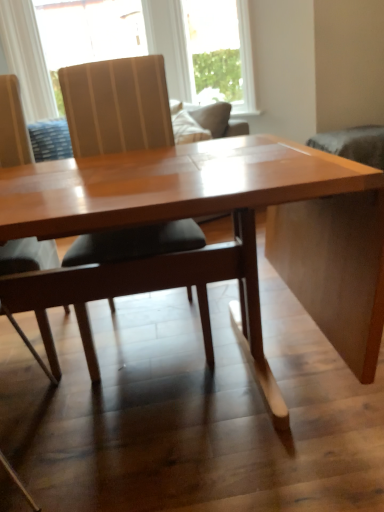
In order to face clear glass window at upper center, the 2th window from the left, should I rotate leftwards or rightwards?

It's best to rotate right around 2.366 degrees.

Describe the element at coordinates (165, 217) in the screenshot. I see `wooden table at center` at that location.

Identify the location of matte wood chair at left, the first chair in the left-to-right sequence. Image resolution: width=384 pixels, height=512 pixels. (13, 125).

Is point (236, 185) positioned after point (236, 113)?

No, (236, 185) is in front of (236, 113).

Considering the sizes of objects wooden table at center and clear glass window at upper center, the 2th window from the left, in the image provided, who is shorter, wooden table at center or clear glass window at upper center, the 2th window from the left,?

wooden table at center is shorter.

From the image's perspective, is wooden table at center under clear glass window at upper center, which is the first window from right to left?

Correct, wooden table at center appears lower than clear glass window at upper center, which is the first window from right to left, in the image.

Is wooden table at center positioned with its back to clear glass window at upper center, which is the first window from right to left?

No, clear glass window at upper center, which is the first window from right to left, is not at the back of wooden table at center.

Considering the sizes of objects wooden table at center and matte wood chair at center, positioned as the second chair in left-to-right order, in the image provided, who is thinner, wooden table at center or matte wood chair at center, positioned as the second chair in left-to-right order,?

matte wood chair at center, positioned as the second chair in left-to-right order, is thinner.

Considering the points (166, 265) and (85, 319), which point is behind, point (166, 265) or point (85, 319)?

The point (85, 319) is farther.

Consider the image. Could you tell me if wooden table at center is turned towards matte wood chair at center, positioned as the second chair in left-to-right order?

No, wooden table at center is not turned towards matte wood chair at center, positioned as the second chair in left-to-right order.

Which object is positioned more to the right, wooden table at center or matte wood chair at center, positioned as the second chair in left-to-right order?

From the viewer's perspective, wooden table at center appears more on the right side.

From a real-world perspective, is matte wood chair at center, positioned as the second chair in left-to-right order, physically located above or below translucent fabric at upper center, the second window in the right-to-left sequence?

matte wood chair at center, positioned as the second chair in left-to-right order, is situated lower than translucent fabric at upper center, the second window in the right-to-left sequence, in the real world.

From the image's perspective, does matte wood chair at center, positioned as the second chair in left-to-right order, appear lower than translucent fabric at upper center, the second window in the right-to-left sequence?

Yes, from the image's perspective, matte wood chair at center, positioned as the second chair in left-to-right order, is below translucent fabric at upper center, the second window in the right-to-left sequence.

Is matte wood chair at center, positioned as the second chair in left-to-right order, facing away from translucent fabric at upper center, the second window in the right-to-left sequence?

Yes, matte wood chair at center, positioned as the second chair in left-to-right order, is positioned with its back facing translucent fabric at upper center, the second window in the right-to-left sequence.

Considering the relative sizes of clear glass window at upper center, the 2th window from the left, and wooden table at center in the image provided, is clear glass window at upper center, the 2th window from the left, thinner than wooden table at center?

Yes.

Which of these two, clear glass window at upper center, the 2th window from the left, or wooden table at center, is bigger?

wooden table at center.

Identify the location of table in front of the clear glass window at upper center, which is the first window from right to left. The image size is (384, 512). (165, 217).

Is clear glass window at upper center, the 2th window from the left, surrounding wooden table at center?

No, wooden table at center is not a part of clear glass window at upper center, the 2th window from the left.

From the image's perspective, which object appears higher, matte wood chair at center, positioned as the second chair in left-to-right order, or clear glass window at upper center, which is the first window from right to left?

clear glass window at upper center, which is the first window from right to left, appears higher in the image.

Is matte wood chair at center, the first chair from the right, oriented towards clear glass window at upper center, which is the first window from right to left?

No, matte wood chair at center, the first chair from the right, is not facing towards clear glass window at upper center, which is the first window from right to left.

Is matte wood chair at center, positioned as the second chair in left-to-right order, at the left side of clear glass window at upper center, which is the first window from right to left?

Yes.

Would you say matte wood chair at center, positioned as the second chair in left-to-right order, is inside or outside clear glass window at upper center, the 2th window from the left?

matte wood chair at center, positioned as the second chair in left-to-right order, is outside clear glass window at upper center, the 2th window from the left.

Between matte wood chair at left, which ranks as the second chair in right-to-left order, and wooden table at center, which one appears on the right side from the viewer's perspective?

From the viewer's perspective, wooden table at center appears more on the right side.

Considering the positions of points (46, 349) and (113, 175), is point (46, 349) farther from camera compared to point (113, 175)?

That is True.

Who is shorter, matte wood chair at left, the first chair in the left-to-right sequence, or wooden table at center?

wooden table at center is shorter.

Between matte wood chair at center, the first chair from the right, and wooden table at center, which one has larger width?

wooden table at center.

Is matte wood chair at center, the first chair from the right, beside wooden table at center?

No, matte wood chair at center, the first chair from the right, is not beside wooden table at center.

Find the location of a particular element. The height and width of the screenshot is (512, 384). table that appears below the matte wood chair at center, positioned as the second chair in left-to-right order (from the image's perspective) is located at coordinates (165, 217).

You are a GUI agent. You are given a task and a screenshot of the screen. Output one action in this format:
    pyautogui.click(x=<x>, y=<y>)
    Task: Click on the table below the clear glass window at upper center, which is the first window from right to left (from a real-world perspective)
    
    Given the screenshot: What is the action you would take?
    pyautogui.click(x=165, y=217)

The height and width of the screenshot is (512, 384). I want to click on table on the right side of matte wood chair at center, the first chair from the right, so click(x=165, y=217).

Looking at the image, which one is located further to translucent fabric at upper center, the first window positioned from the left, clear glass window at upper center, the 2th window from the left, or matte wood chair at center, positioned as the second chair in left-to-right order?

matte wood chair at center, positioned as the second chair in left-to-right order, is positioned further to the anchor translucent fabric at upper center, the first window positioned from the left.

Considering their positions, is matte wood chair at center, positioned as the second chair in left-to-right order, positioned closer to clear glass window at upper center, the 2th window from the left, than matte wood chair at left, the first chair in the left-to-right sequence?

matte wood chair at center, positioned as the second chair in left-to-right order, is positioned closer to the anchor clear glass window at upper center, the 2th window from the left.

In the scene shown: Looking at the image, which one is located closer to matte wood chair at center, the first chair from the right, clear glass window at upper center, the 2th window from the left, or matte wood chair at left, the first chair in the left-to-right sequence?

matte wood chair at left, the first chair in the left-to-right sequence, is closer to matte wood chair at center, the first chair from the right.

When comparing their distances from clear glass window at upper center, the 2th window from the left, does matte wood chair at left, which ranks as the second chair in right-to-left order, or translucent fabric at upper center, the first window positioned from the left, seem further?

Based on the image, matte wood chair at left, which ranks as the second chair in right-to-left order, appears to be further to clear glass window at upper center, the 2th window from the left.

Based on their spatial positions, is wooden table at center or matte wood chair at left, which ranks as the second chair in right-to-left order, closer to matte wood chair at center, positioned as the second chair in left-to-right order?

wooden table at center is positioned closer to the anchor matte wood chair at center, positioned as the second chair in left-to-right order.

Considering their positions, is matte wood chair at center, positioned as the second chair in left-to-right order, positioned further to matte wood chair at left, which ranks as the second chair in right-to-left order, than clear glass window at upper center, which is the first window from right to left?

clear glass window at upper center, which is the first window from right to left, is positioned further to the anchor matte wood chair at left, which ranks as the second chair in right-to-left order.

Looking at the image, which one is located further to matte wood chair at left, the first chair in the left-to-right sequence, translucent fabric at upper center, the first window positioned from the left, or wooden table at center?

translucent fabric at upper center, the first window positioned from the left, is further to matte wood chair at left, the first chair in the left-to-right sequence.

Based on their spatial positions, is clear glass window at upper center, the 2th window from the left, or matte wood chair at center, positioned as the second chair in left-to-right order, closer to wooden table at center?

Among the two, matte wood chair at center, positioned as the second chair in left-to-right order, is located nearer to wooden table at center.

Identify the location of chair located between matte wood chair at center, the first chair from the right, and clear glass window at upper center, which is the first window from right to left, in the depth direction. The image size is (384, 512). (13, 125).

At what (x,y) coordinates should I click in order to perform the action: click on chair situated between matte wood chair at left, which ranks as the second chair in right-to-left order, and wooden table at center from left to right. Please return your answer as a coordinate pair (x, y). This screenshot has height=512, width=384. Looking at the image, I should click on (117, 105).

At what (x,y) coordinates should I click in order to perform the action: click on window between wooden table at center and translucent fabric at upper center, the first window positioned from the left, in the front-back direction. Please return your answer as a coordinate pair (x, y). Looking at the image, I should click on (220, 53).

Find the location of a particular element. chair between matte wood chair at center, the first chair from the right, and translucent fabric at upper center, the first window positioned from the left, in the front-back direction is located at coordinates (13, 125).